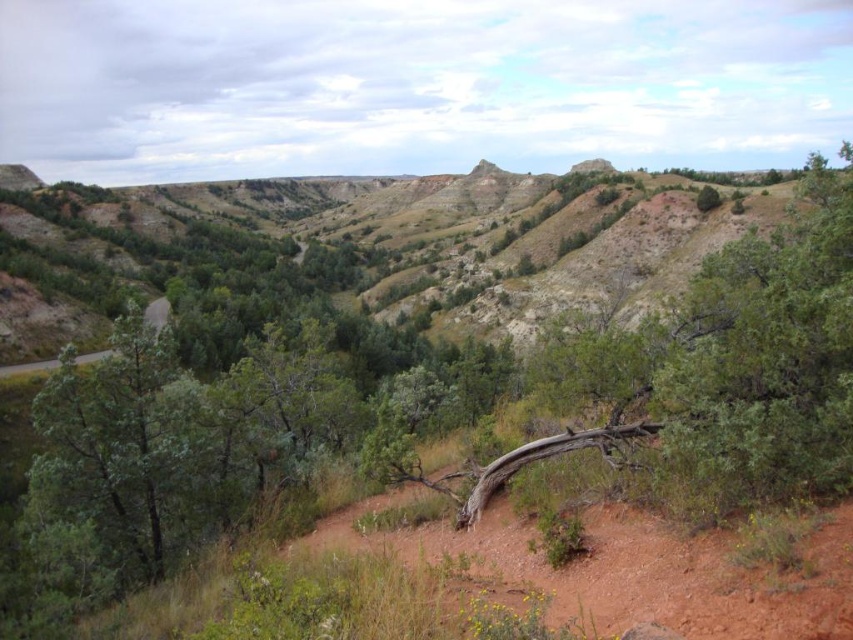
Does brown rough tree trunk at center have a greater height compared to brown dirt track at center?

Yes.

Between point (601, 385) and point (730, 554), which one is positioned in front?

Positioned in front is point (730, 554).

The width and height of the screenshot is (853, 640). Describe the element at coordinates (717, 372) in the screenshot. I see `brown rough tree trunk at center` at that location.

Find the location of a particular element. The width and height of the screenshot is (853, 640). brown rough tree trunk at center is located at coordinates (717, 372).